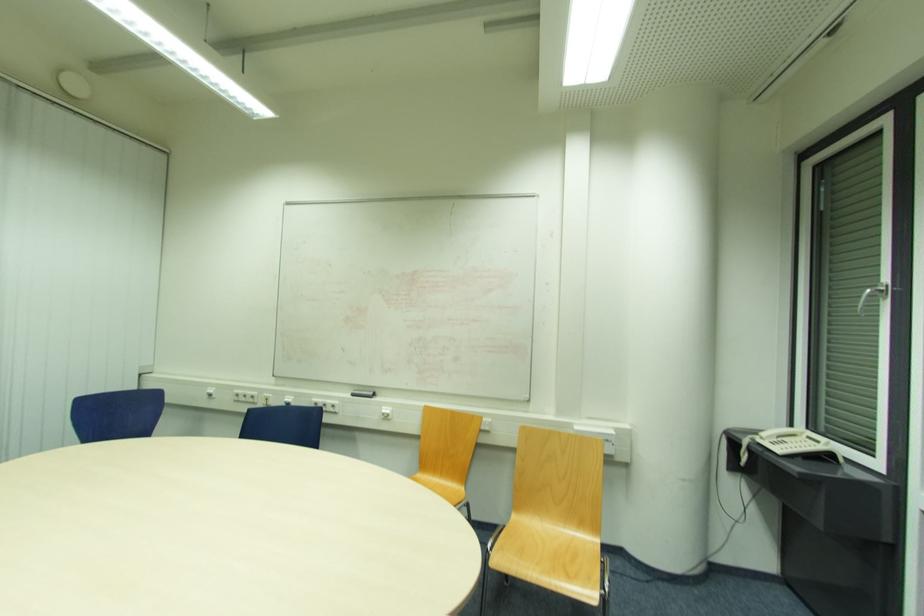
Locate an element on the screen. silver window handle is located at coordinates (871, 294).